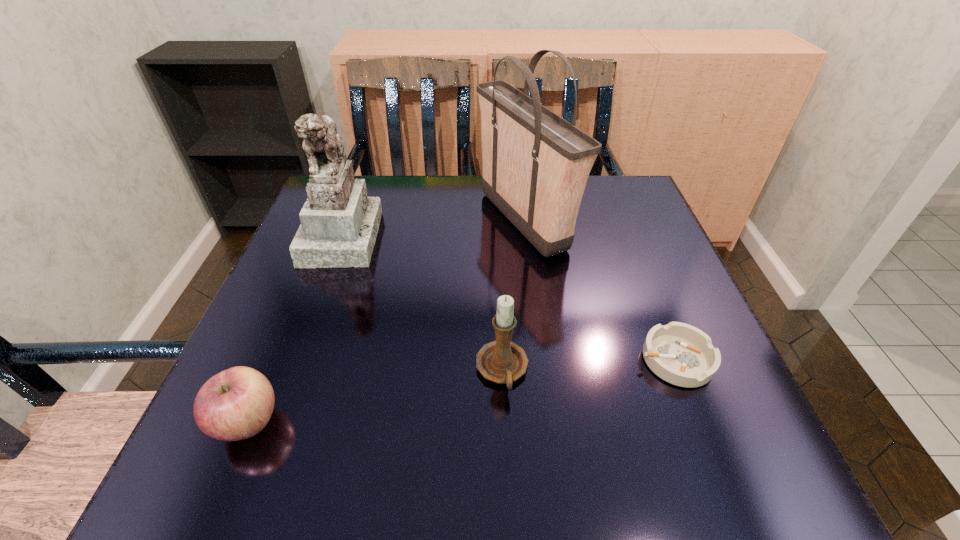
The width and height of the screenshot is (960, 540). What are the coordinates of `vacant point that satisfies the following two spatial constraints: 1. on the front-facing side of the shortest object; 2. on the right side of the second tallest object` in the screenshot? It's located at (296, 360).

Locate an element on the screen. vacant space that satisfies the following two spatial constraints: 1. on the front-facing side of the fourth shortest object; 2. on the front side of the apple is located at coordinates (273, 422).